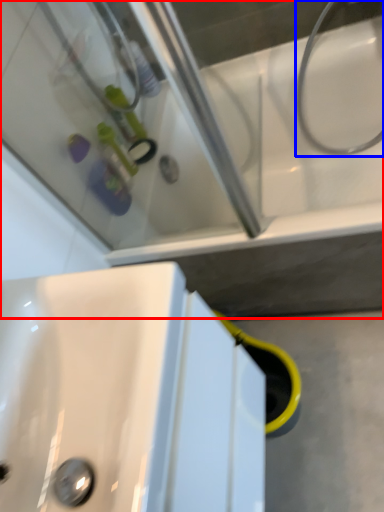
Question: Which object is closer to the camera taking this photo, bath (highlighted by a red box) or plumbing fixture (highlighted by a blue box)?

Choices:
 (A) bath
 (B) plumbing fixture

Answer: (A)